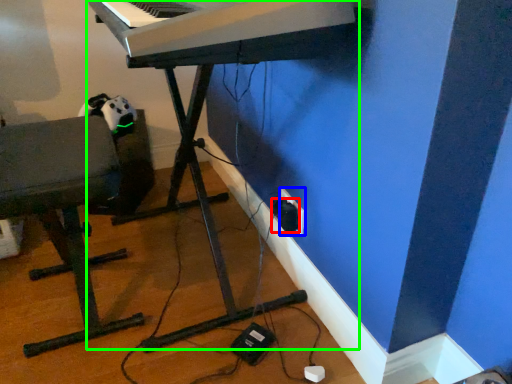
Question: Which object is positioned closest to plug (highlighted by a red box)? Select from electric outlet (highlighted by a blue box) and piano (highlighted by a green box).

Choices:
 (A) electric outlet
 (B) piano

Answer: (A)